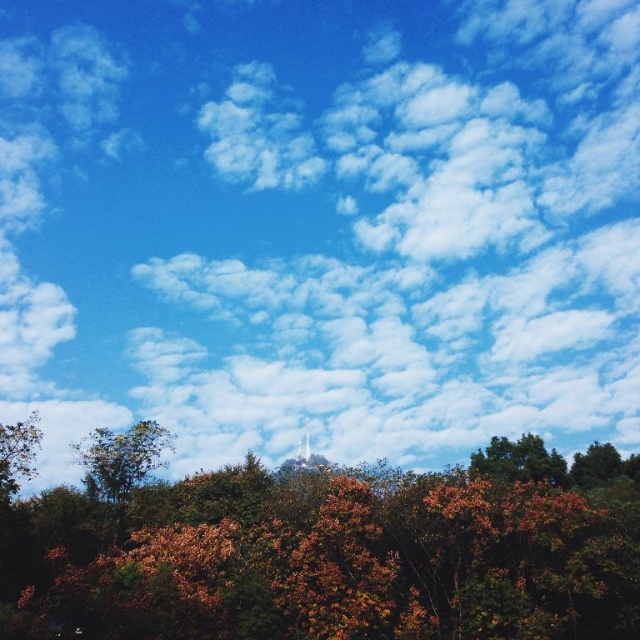
Is brown matte tree at lower center in front of green leafy tree at left?

Yes, it is in front of green leafy tree at left.

Who is more forward, (372, 500) or (19, 451)?

Point (372, 500)

What do you see at coordinates (324, 554) in the screenshot? This screenshot has width=640, height=640. I see `brown matte tree at lower center` at bounding box center [324, 554].

Find the location of a particular element. brown matte tree at lower center is located at coordinates (324, 554).

Image resolution: width=640 pixels, height=640 pixels. Describe the element at coordinates (122, 464) in the screenshot. I see `green matte tree at lower left` at that location.

Which of these two, green matte tree at lower left or green leafy tree at left, stands shorter?

green leafy tree at left is shorter.

Image resolution: width=640 pixels, height=640 pixels. What do you see at coordinates (122, 464) in the screenshot? I see `green matte tree at lower left` at bounding box center [122, 464].

Locate an element on the screen. The image size is (640, 640). green matte tree at lower left is located at coordinates (122, 464).

Can you confirm if green matte tree at lower left is bigger than green matte tree at lower right?

Yes, green matte tree at lower left is bigger than green matte tree at lower right.

Between green matte tree at lower left and green matte tree at lower right, which one has more height?

green matte tree at lower left is taller.

What do you see at coordinates (122, 464) in the screenshot?
I see `green matte tree at lower left` at bounding box center [122, 464].

Image resolution: width=640 pixels, height=640 pixels. I want to click on green matte tree at lower left, so click(x=122, y=464).